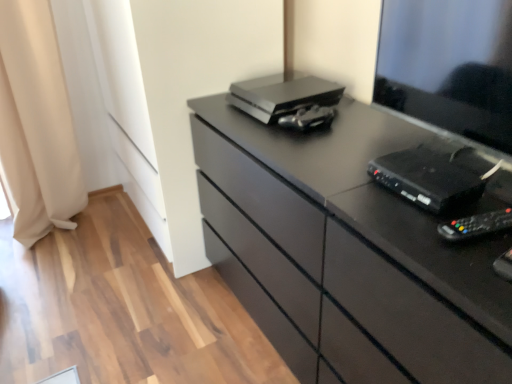
Find the location of a particular element. blank space to the left of black plastic remote control at right, acting as the 3th equipment starting from the back is located at coordinates click(x=399, y=226).